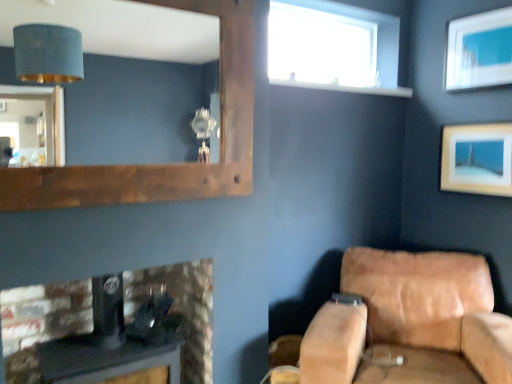
Question: Considering the relative positions of transparent glass window at upper center and black leather speaker at lower left in the image provided, is transparent glass window at upper center to the right of black leather speaker at lower left from the viewer's perspective?

Choices:
 (A) no
 (B) yes

Answer: (B)

Question: Can you confirm if transparent glass window at upper center is bigger than black leather speaker at lower left?

Choices:
 (A) yes
 (B) no

Answer: (B)

Question: Would you say transparent glass window at upper center is a long distance from black leather speaker at lower left?

Choices:
 (A) no
 (B) yes

Answer: (B)

Question: Considering the relative positions of transparent glass window at upper center and black leather speaker at lower left in the image provided, is transparent glass window at upper center to the left of black leather speaker at lower left from the viewer's perspective?

Choices:
 (A) yes
 (B) no

Answer: (B)

Question: Considering the relative sizes of transparent glass window at upper center and black leather speaker at lower left in the image provided, is transparent glass window at upper center shorter than black leather speaker at lower left?

Choices:
 (A) yes
 (B) no

Answer: (A)

Question: From the image's perspective, relative to transparent glass window at upper center, is black leather speaker at lower left above or below?

Choices:
 (A) below
 (B) above

Answer: (A)

Question: Is black leather speaker at lower left in front of or behind transparent glass window at upper center in the image?

Choices:
 (A) front
 (B) behind

Answer: (A)

Question: Considering the positions of point (10, 297) and point (304, 51), is point (10, 297) closer or farther from the camera than point (304, 51)?

Choices:
 (A) farther
 (B) closer

Answer: (B)

Question: From a real-world perspective, relative to transparent glass window at upper center, is black leather speaker at lower left vertically above or below?

Choices:
 (A) below
 (B) above

Answer: (A)

Question: Is wooden picture frame at upper right, which is the 1th picture frame from bottom to top, bigger or smaller than brown wooden mirror at upper left?

Choices:
 (A) big
 (B) small

Answer: (B)

Question: Considering their positions, is wooden picture frame at upper right, the 2th picture frame from the top, located in front of or behind brown wooden mirror at upper left?

Choices:
 (A) behind
 (B) front

Answer: (A)

Question: Considering the relative positions of wooden picture frame at upper right, which is the 1th picture frame from bottom to top, and brown wooden mirror at upper left in the image provided, is wooden picture frame at upper right, which is the 1th picture frame from bottom to top, to the left or to the right of brown wooden mirror at upper left?

Choices:
 (A) right
 (B) left

Answer: (A)

Question: Is point (501, 152) positioned closer to the camera than point (137, 99)?

Choices:
 (A) closer
 (B) farther

Answer: (A)

Question: Relative to wooden picture frame at upper right, the 2th picture frame from the top, is tan leather couch at lower right in front or behind?

Choices:
 (A) front
 (B) behind

Answer: (A)

Question: In terms of width, does tan leather couch at lower right look wider or thinner when compared to wooden picture frame at upper right, the 2th picture frame from the top?

Choices:
 (A) wide
 (B) thin

Answer: (A)